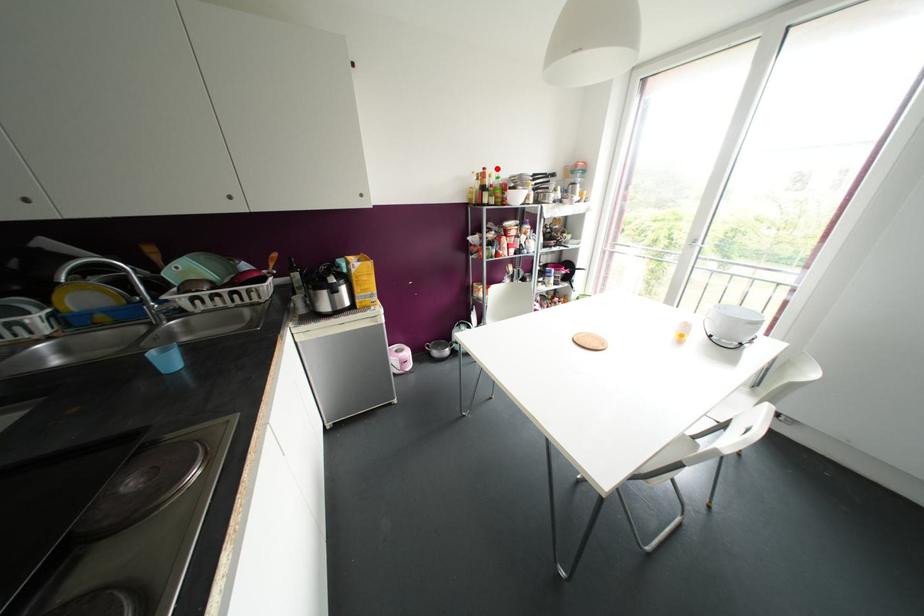
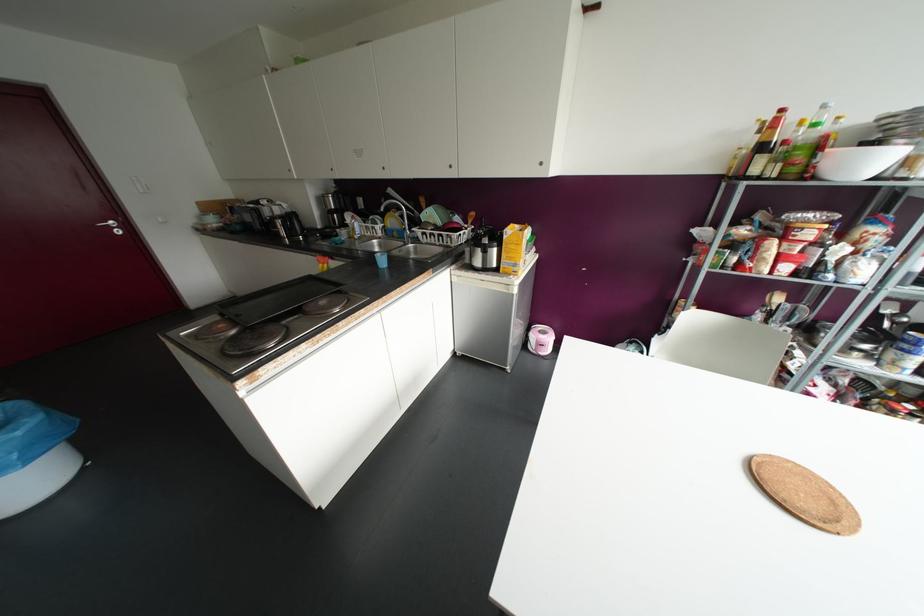
In the second image, find the point that corresponds to the highlighted location in the first image.

(823, 106)